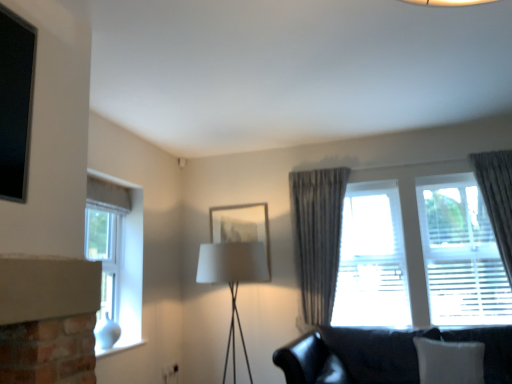
Question: Is there a large distance between white fabric pillow at lower right and translucent fabric curtain at right, the 1th window in the right-to-left sequence?

Choices:
 (A) yes
 (B) no

Answer: (A)

Question: Is white fabric pillow at lower right to the left of translucent fabric curtain at right, which is the second window in left-to-right order, from the viewer's perspective?

Choices:
 (A) yes
 (B) no

Answer: (A)

Question: From a real-world perspective, is white fabric pillow at lower right on top of translucent fabric curtain at right, the 1th window in the right-to-left sequence?

Choices:
 (A) yes
 (B) no

Answer: (B)

Question: From the image's perspective, is white fabric pillow at lower right on top of translucent fabric curtain at right, which is the second window in left-to-right order?

Choices:
 (A) no
 (B) yes

Answer: (A)

Question: From the image's perspective, is white fabric pillow at lower right under translucent fabric curtain at right, the 1th window in the right-to-left sequence?

Choices:
 (A) yes
 (B) no

Answer: (A)

Question: Is white fabric pillow at lower right oriented towards translucent fabric curtain at right, which is the second window in left-to-right order?

Choices:
 (A) yes
 (B) no

Answer: (B)

Question: Considering the relative sizes of white fabric pillow at lower right and matte glass picture frame at center in the image provided, is white fabric pillow at lower right taller than matte glass picture frame at center?

Choices:
 (A) no
 (B) yes

Answer: (A)

Question: Can you confirm if white fabric pillow at lower right is shorter than matte glass picture frame at center?

Choices:
 (A) no
 (B) yes

Answer: (B)

Question: Would you say white fabric pillow at lower right is a long distance from matte glass picture frame at center?

Choices:
 (A) no
 (B) yes

Answer: (B)

Question: Can you see white fabric pillow at lower right touching matte glass picture frame at center?

Choices:
 (A) yes
 (B) no

Answer: (B)

Question: Is white fabric pillow at lower right facing away from matte glass picture frame at center?

Choices:
 (A) yes
 (B) no

Answer: (B)

Question: Could you tell me if white fabric pillow at lower right is facing matte glass picture frame at center?

Choices:
 (A) yes
 (B) no

Answer: (B)

Question: Is white glass window at left, the 1th window in the left-to-right sequence, directly adjacent to translucent fabric curtain at right, which is the second window in left-to-right order?

Choices:
 (A) yes
 (B) no

Answer: (B)